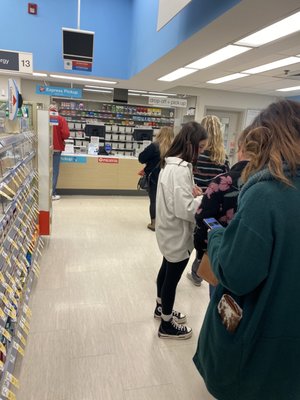
Find the location of a particular element. The width and height of the screenshot is (300, 400). space on front of counter is located at coordinates (83, 176).